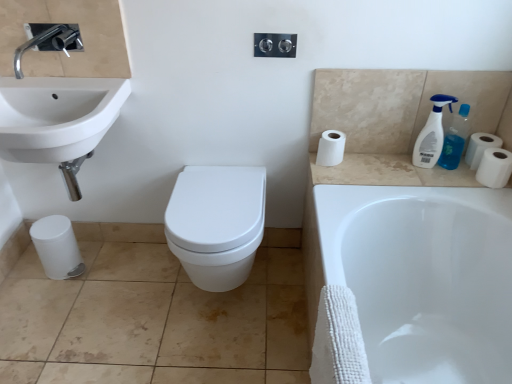
Question: From a real-world perspective, relative to white matte toilet paper at right, which appears as the 3th toilet paper when ordered from the bottom, is white matte toilet paper at lower left, the 1th toilet paper in the bottom-to-top sequence, vertically above or below?

Choices:
 (A) below
 (B) above

Answer: (A)

Question: Looking at their shapes, would you say white matte toilet paper at lower left, the 1th toilet paper in the bottom-to-top sequence, is wider or thinner than white matte toilet paper at right, acting as the 2th toilet paper starting from the top?

Choices:
 (A) thin
 (B) wide

Answer: (B)

Question: Estimate the real-world distances between objects in this image. Which object is farther from the white plastic spray bottle at upper right, arranged as the second cleaning product when viewed from the right?

Choices:
 (A) white glossy bathtub at lower right
 (B) white glossy toilet at center
 (C) black metallic faucet at upper left
 (D) white textured towel at lower right
 (E) beige tile at lower left

Answer: (C)

Question: Considering the real-world distances, which object is farthest from the white matte toilet paper at upper right, placed as the 1th toilet paper when sorted from top to bottom?

Choices:
 (A) white glossy toilet at center
 (B) white textured towel at lower right
 (C) white glossy sink at upper left
 (D) white matte toilet paper at right, the fourth toilet paper positioned from the left
 (E) beige tile at lower left

Answer: (C)